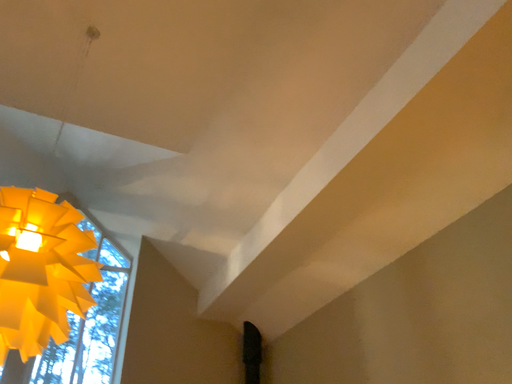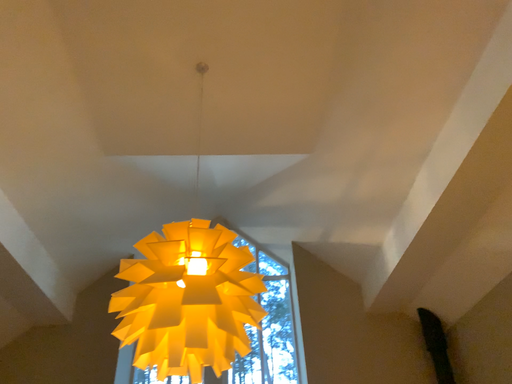
Question: How did the camera likely rotate when shooting the video?

Choices:
 (A) rotated right
 (B) rotated left

Answer: (B)